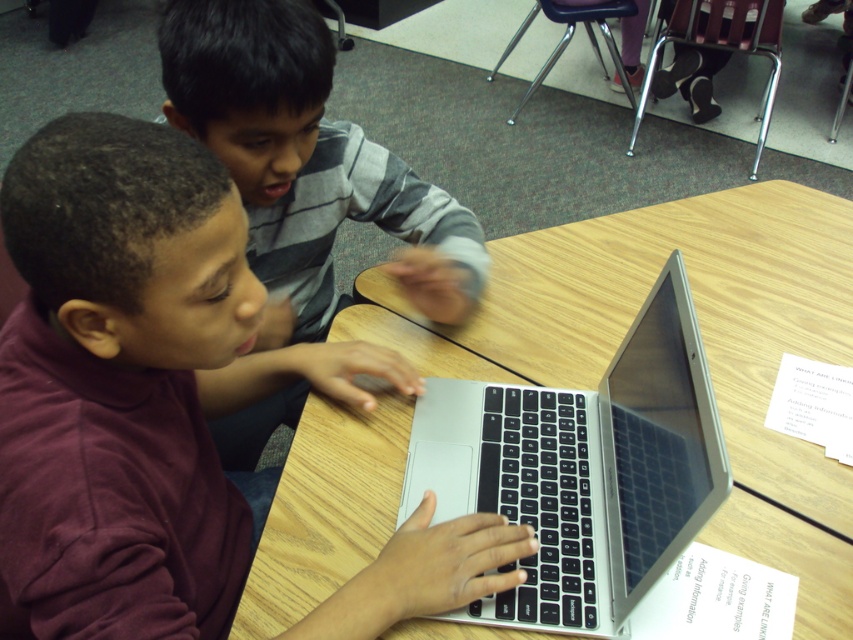
You are a teacher observing two students working at a table. You notice the maroon fabric shirt at lower left and the gray striped sweater at upper center. Which student is sitting closer to the front of the table?

The maroon fabric shirt at lower left is shorter than the gray striped sweater at upper center, so the student in the maroon fabric shirt at lower left is sitting closer to the front of the table.

You are standing in a classroom and see the point at coordinates (590,314). If you want to place a small book there, will it fit without overlapping anything else?

The point at coordinates (590,314) has a distance of 1.23 meters from the viewer, so placing a small book there would be possible as there are no overlapping objects mentioned in the scene description.